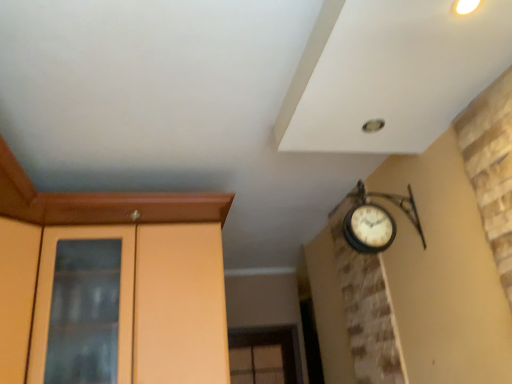
Question: Looking at the image, does matte wood dresser at left seem bigger or smaller compared to matte wood door at left?

Choices:
 (A) small
 (B) big

Answer: (B)

Question: From the image's perspective, is matte wood dresser at left above or below matte wood door at left?

Choices:
 (A) above
 (B) below

Answer: (B)

Question: Is matte wood dresser at left wider or thinner than matte wood door at left?

Choices:
 (A) wide
 (B) thin

Answer: (B)

Question: Is matte wood door at left wider or thinner than matte wood dresser at left?

Choices:
 (A) thin
 (B) wide

Answer: (B)

Question: Is point (4, 228) closer or farther from the camera than point (197, 314)?

Choices:
 (A) farther
 (B) closer

Answer: (B)

Question: From the image's perspective, is matte wood door at left located above or below matte wood dresser at left?

Choices:
 (A) below
 (B) above

Answer: (B)

Question: Considering the positions of matte wood door at left and matte wood dresser at left in the image, is matte wood door at left taller or shorter than matte wood dresser at left?

Choices:
 (A) tall
 (B) short

Answer: (B)